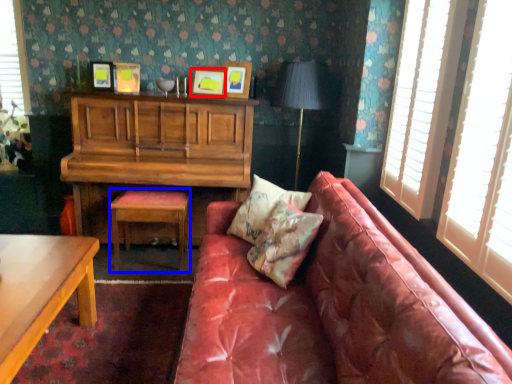
Question: Among these objects, which one is farthest to the camera, picture frame (highlighted by a red box) or stool (highlighted by a blue box)?

Choices:
 (A) picture frame
 (B) stool

Answer: (A)